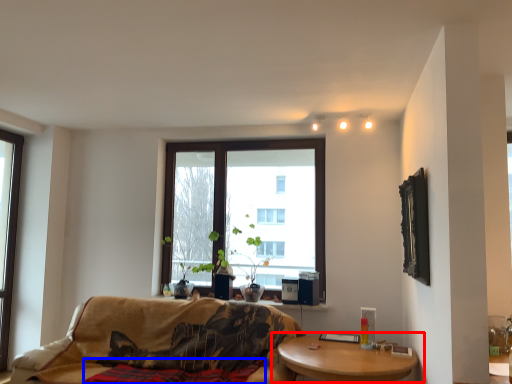
Question: Which point is further to the camera, coffee table (highlighted by a red box) or blanket (highlighted by a blue box)?

Choices:
 (A) coffee table
 (B) blanket

Answer: (B)